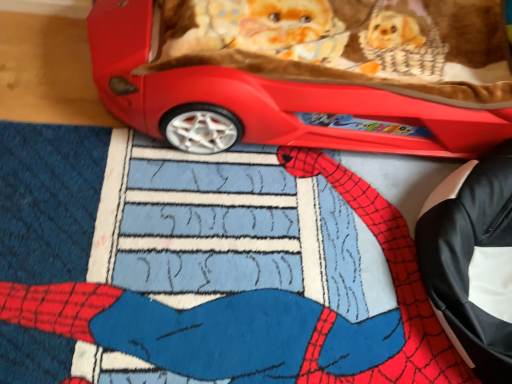
Where is `matte plastic car at upper center`? The image size is (512, 384). matte plastic car at upper center is located at coordinates (271, 98).

What do you see at coordinates (271, 98) in the screenshot?
I see `matte plastic car at upper center` at bounding box center [271, 98].

This screenshot has width=512, height=384. I want to click on matte plastic car at upper center, so click(271, 98).